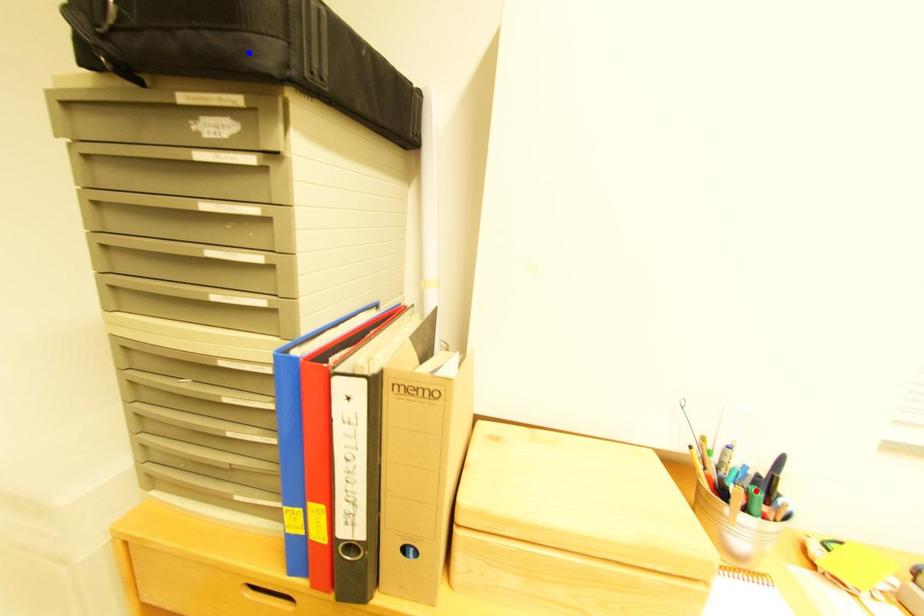
Question: Which of the two points in the image is closer to the camera?

Choices:
 (A) Blue point is closer.
 (B) Red point is closer.

Answer: (A)